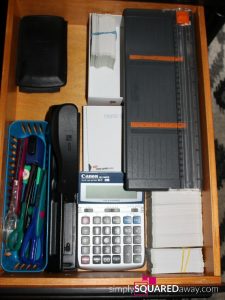
This screenshot has width=225, height=300. What are the coordinates of `drawer` in the screenshot? It's located at (217, 251).